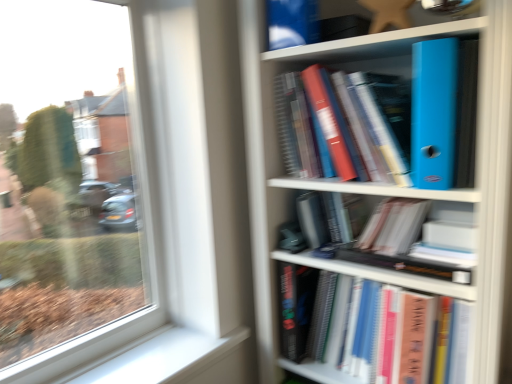
Question: Considering the relative sizes of matte plastic bookcase at right and hardcover book at center, which is the 1th book in bottom-to-top order, in the image provided, is matte plastic bookcase at right taller than hardcover book at center, which is the 1th book in bottom-to-top order,?

Choices:
 (A) yes
 (B) no

Answer: (A)

Question: Are matte plastic bookcase at right and hardcover book at center, which is the 1th book in bottom-to-top order, located far from each other?

Choices:
 (A) no
 (B) yes

Answer: (A)

Question: Is matte plastic bookcase at right completely or partially outside of hardcover book at center, which is the second book from top to bottom?

Choices:
 (A) yes
 (B) no

Answer: (A)

Question: Can you confirm if matte plastic bookcase at right is wider than hardcover book at center, which is the 1th book in bottom-to-top order?

Choices:
 (A) no
 (B) yes

Answer: (B)

Question: Is matte plastic bookcase at right smaller than hardcover book at center, which is the 1th book in bottom-to-top order?

Choices:
 (A) no
 (B) yes

Answer: (A)

Question: Considering the positions of point (448, 122) and point (303, 365), is point (448, 122) closer or farther from the camera than point (303, 365)?

Choices:
 (A) closer
 (B) farther

Answer: (A)

Question: From a real-world perspective, is blue plastic folder at upper right, which is the first book from top to bottom, positioned above or below matte plastic bookcase at right?

Choices:
 (A) above
 (B) below

Answer: (A)

Question: Is blue plastic folder at upper right, which is the first book from top to bottom, wider or thinner than matte plastic bookcase at right?

Choices:
 (A) thin
 (B) wide

Answer: (A)

Question: In the image, is blue plastic folder at upper right, marked as the second book in a bottom-to-top arrangement, positioned in front of or behind matte plastic bookcase at right?

Choices:
 (A) front
 (B) behind

Answer: (B)

Question: Is blue plastic folder at upper right, marked as the second book in a bottom-to-top arrangement, inside the boundaries of hardcover book at center, which is the second book from top to bottom, or outside?

Choices:
 (A) outside
 (B) inside

Answer: (A)

Question: Is point (443, 97) positioned closer to the camera than point (415, 372)?

Choices:
 (A) farther
 (B) closer

Answer: (B)

Question: From the image's perspective, is blue plastic folder at upper right, marked as the second book in a bottom-to-top arrangement, positioned above or below hardcover book at center, which is the second book from top to bottom?

Choices:
 (A) above
 (B) below

Answer: (A)

Question: In terms of size, does blue plastic folder at upper right, which is the first book from top to bottom, appear bigger or smaller than hardcover book at center, which is the second book from top to bottom?

Choices:
 (A) big
 (B) small

Answer: (B)

Question: Considering the relative positions of white smooth window sill at lower left and hardcover book at center, which is the 1th book in bottom-to-top order, in the image provided, is white smooth window sill at lower left to the left or to the right of hardcover book at center, which is the 1th book in bottom-to-top order,?

Choices:
 (A) left
 (B) right

Answer: (A)

Question: Is point [152, 357] positioned closer to the camera than point [354, 296]?

Choices:
 (A) farther
 (B) closer

Answer: (A)